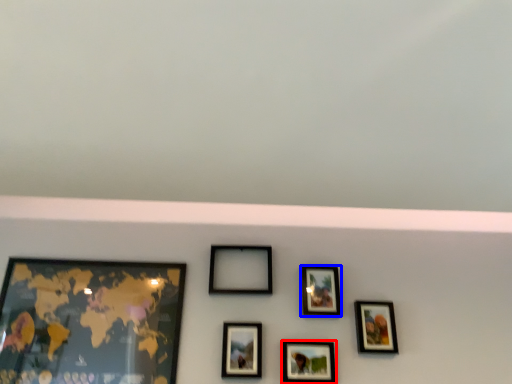
Question: Which object appears closest to the camera in this image, picture frame (highlighted by a red box) or picture frame (highlighted by a blue box)?

Choices:
 (A) picture frame
 (B) picture frame

Answer: (A)